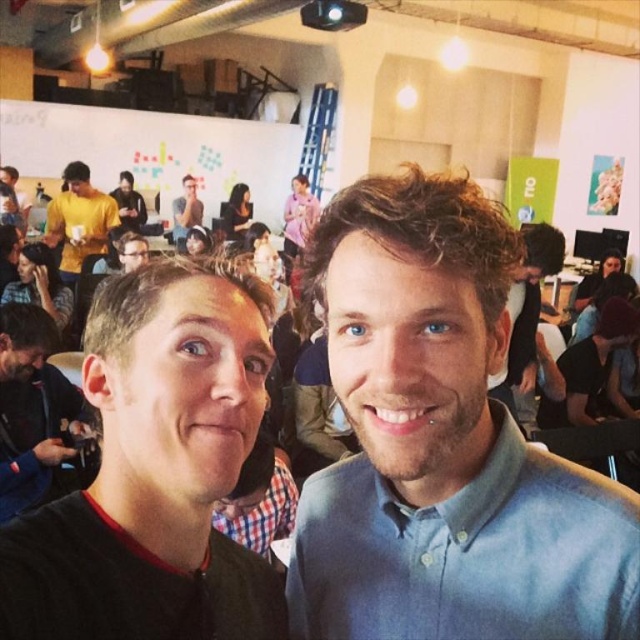
Question: Can you confirm if black leather jacket at left is smaller than matte gray shirt at upper center?

Choices:
 (A) no
 (B) yes

Answer: (B)

Question: Which of the following is the closest to the observer?

Choices:
 (A) (12, 506)
 (B) (189, 205)
 (C) (241, 444)

Answer: (C)

Question: Which object is the farthest from the yellow matte shirt at upper left?

Choices:
 (A) blue matte shirt at center
 (B) black leather jacket at left
 (C) blue cotton shirt at center

Answer: (C)

Question: Which object appears farthest from the camera in this image?

Choices:
 (A) yellow matte shirt at upper left
 (B) black leather jacket at left
 (C) blue cotton shirt at center

Answer: (A)

Question: Does blue cotton shirt at center have a larger size compared to blue matte shirt at center?

Choices:
 (A) no
 (B) yes

Answer: (A)

Question: Is black matte shirt at center smaller than matte gray shirt at upper center?

Choices:
 (A) no
 (B) yes

Answer: (B)